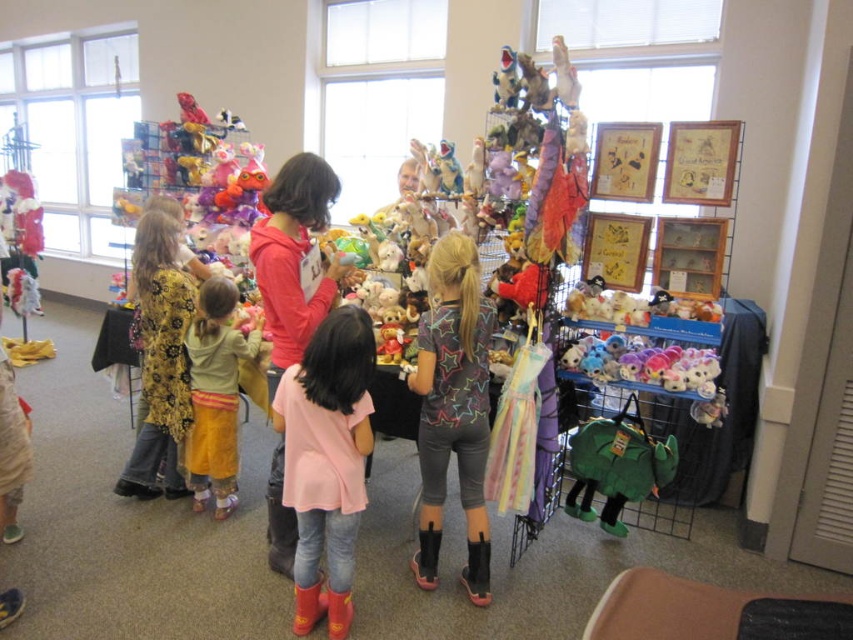
Question: Does pink fabric shirt at center have a lesser width compared to yellow cotton dress at lower left?

Choices:
 (A) yes
 (B) no

Answer: (B)

Question: Can you confirm if gray matte leggings at center is positioned below floral-patterned dress at center?

Choices:
 (A) no
 (B) yes

Answer: (B)

Question: Estimate the real-world distances between objects in this image. Which object is farther from the green fabric backpack at lower right?

Choices:
 (A) gray matte leggings at center
 (B) pink fabric shirt at center
 (C) pink matte hoodie at center

Answer: (C)

Question: Which object appears closest to the camera in this image?

Choices:
 (A) floral-patterned dress at center
 (B) green fabric backpack at lower right

Answer: (B)

Question: Is pink matte hoodie at center further to camera compared to green fabric backpack at lower right?

Choices:
 (A) yes
 (B) no

Answer: (B)

Question: Which point is farther to the camera?

Choices:
 (A) (426, 392)
 (B) (178, 276)

Answer: (B)